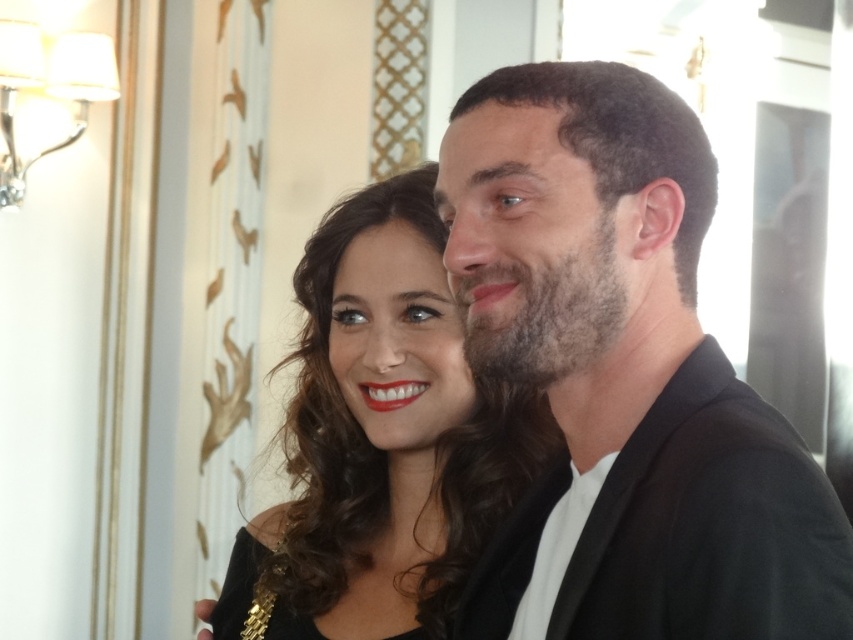
Does shiny black dress at center come in front of black satin dress at center?

Yes, shiny black dress at center is closer to the viewer.

Is point (393, 291) closer to viewer compared to point (265, 550)?

Yes, point (393, 291) is closer to viewer.

Who is more forward, (405,428) or (242,596)?

Positioned in front is point (405,428).

This screenshot has width=853, height=640. I want to click on shiny black dress at center, so click(x=381, y=440).

Identify the location of matte black hair at center. Image resolution: width=853 pixels, height=640 pixels. (397, 340).

Is the position of matte black hair at center more distant than that of black satin dress at center?

Yes, it is.

Does point (357, 253) come in front of point (231, 602)?

Yes, point (357, 253) is closer to viewer.

Identify the location of matte black hair at center. This screenshot has height=640, width=853. (397, 340).

How much distance is there between smooth black jacket at right and shiny black dress at center?

A distance of 15.76 inches exists between smooth black jacket at right and shiny black dress at center.

Can you confirm if smooth black jacket at right is positioned to the left of shiny black dress at center?

No, smooth black jacket at right is not to the left of shiny black dress at center.

Who is more forward, (589, 96) or (379, 333)?

Point (589, 96) is in front.

Find the location of `smooth black jacket at right`. smooth black jacket at right is located at coordinates (624, 376).